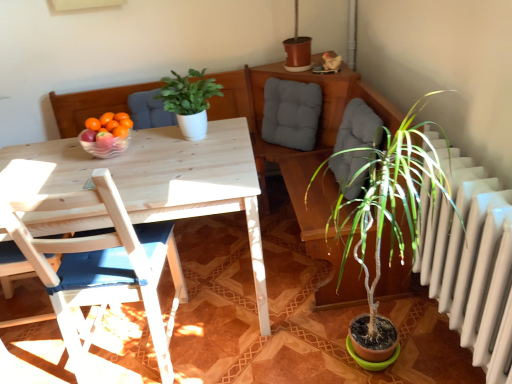
Question: Is wooden chair with blue cushion at left thinner than green matte plant at center?

Choices:
 (A) yes
 (B) no

Answer: (B)

Question: Is wooden chair with blue cushion at left directly adjacent to green matte plant at center?

Choices:
 (A) no
 (B) yes

Answer: (A)

Question: From a real-world perspective, is wooden chair with blue cushion at left below green matte plant at center?

Choices:
 (A) yes
 (B) no

Answer: (A)

Question: Does wooden chair with blue cushion at left have a larger size compared to green matte plant at center?

Choices:
 (A) yes
 (B) no

Answer: (A)

Question: Would you say green matte plant at center is part of wooden chair with blue cushion at left's contents?

Choices:
 (A) no
 (B) yes

Answer: (A)

Question: Is wooden chair with blue cushion at left to the left of green matte plant at center from the viewer's perspective?

Choices:
 (A) yes
 (B) no

Answer: (A)

Question: Is green matte plant at center not near wooden chair with blue cushion at left?

Choices:
 (A) yes
 (B) no

Answer: (B)

Question: Is wooden chair with blue cushion at left located within green matte plant at center?

Choices:
 (A) no
 (B) yes

Answer: (A)

Question: Can you confirm if green matte plant at center is shorter than wooden chair with blue cushion at left?

Choices:
 (A) yes
 (B) no

Answer: (A)

Question: Is the surface of green matte plant at center in direct contact with wooden chair with blue cushion at left?

Choices:
 (A) yes
 (B) no

Answer: (B)

Question: From the image's perspective, is green matte plant at center below wooden chair with blue cushion at left?

Choices:
 (A) yes
 (B) no

Answer: (B)

Question: Is green matte plant at center smaller than wooden chair with blue cushion at left?

Choices:
 (A) yes
 (B) no

Answer: (A)

Question: Does gray fabric cushion at upper center appear on the right side of transparent glass bowl at table?

Choices:
 (A) yes
 (B) no

Answer: (A)